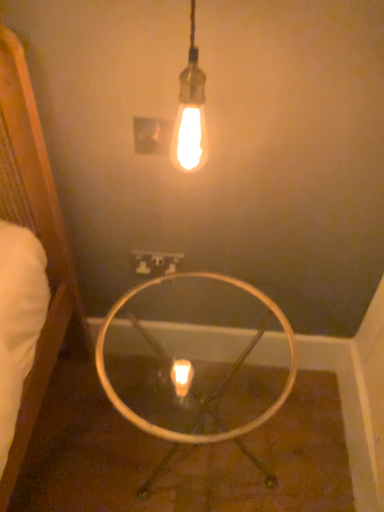
Locate an element on the screen. This screenshot has height=512, width=384. clear glass table at center is located at coordinates (184, 433).

The height and width of the screenshot is (512, 384). Describe the element at coordinates (184, 433) in the screenshot. I see `clear glass table at center` at that location.

Image resolution: width=384 pixels, height=512 pixels. What are the coordinates of `clear glass table at center` in the screenshot? It's located at (184, 433).